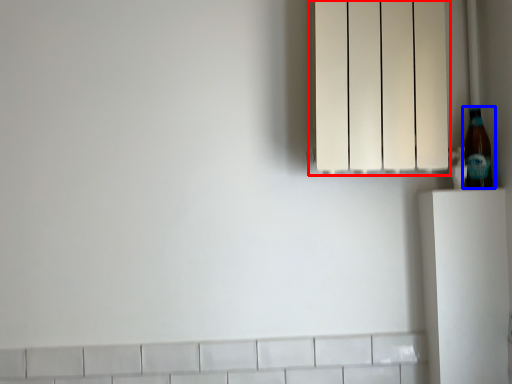
Question: Which object is further to the camera taking this photo, lamp (highlighted by a red box) or bottle (highlighted by a blue box)?

Choices:
 (A) lamp
 (B) bottle

Answer: (B)